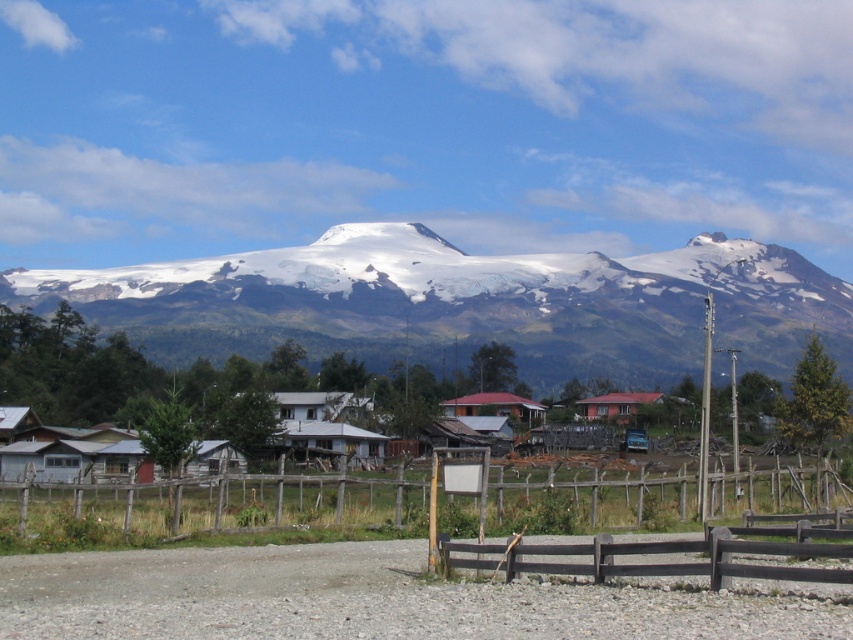
You are standing in the rural landscape and want to take a photo of the wooden fence at center and the rustic wooden houses at center. Based on their positions, which object should appear higher in the photo?

The wooden fence at center should appear higher in the photo because it is positioned above the rustic wooden houses at center.

You are standing at the point with coordinates point [76,460] and want to reach the snow capped mountain range in the background. Which direction should you move to get closer to the mountain range?

The point [76,460] corresponds to rustic wooden houses at center, so you should move towards the background direction to get closer to the snow capped mountain range in the background.